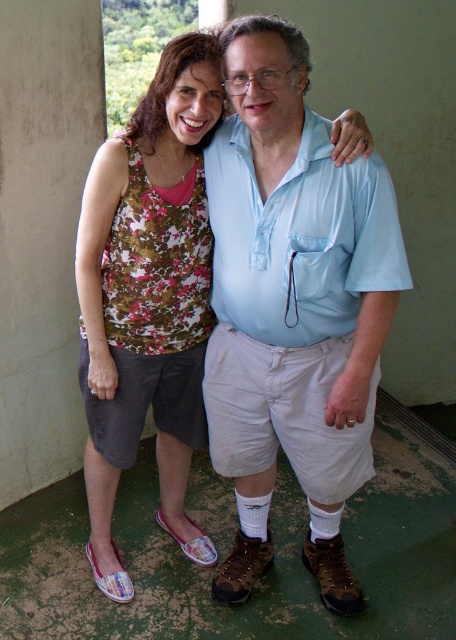
Question: Among these objects, which one is nearest to the camera?

Choices:
 (A) floral fabric tank top at center
 (B) light blue cotton shirt at center

Answer: (B)

Question: Does light blue cotton shirt at center have a lesser width compared to floral fabric tank top at center?

Choices:
 (A) no
 (B) yes

Answer: (A)

Question: Is light blue cotton shirt at center closer to camera compared to floral fabric tank top at center?

Choices:
 (A) yes
 (B) no

Answer: (A)

Question: Does light blue cotton shirt at center have a larger size compared to floral fabric tank top at center?

Choices:
 (A) yes
 (B) no

Answer: (B)